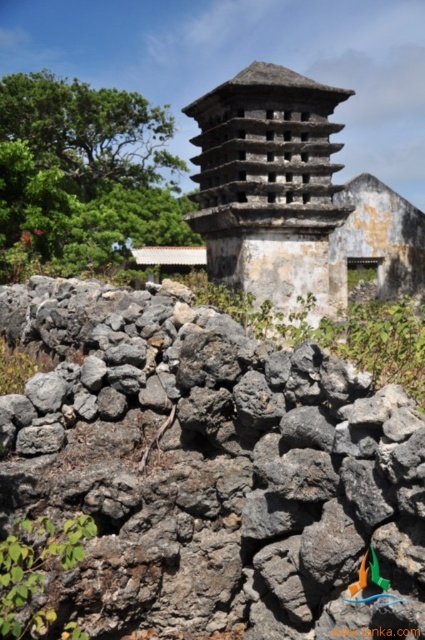
You are an architect assessing the stability of the gray stone tower at center. Given that the volcanic rock wall at center is smaller in size, how does this affect the tower?

The volcanic rock wall at center occupies less space than the gray stone tower at center, so the tower is more stable because it has a larger base area.

You are a geologist examining the historical site. You notice the volcanic rock wall at center and the gray stone tower at center. Based on their positions, which one is located lower in the scene?

The volcanic rock wall at center is positioned under the gray stone tower at center, so it is located lower in the scene.

You are an architect planning to reinforce the structural stability of the gray stone tower at center. The volcanic rock wall at center is nearby. Which structure has a greater thickness that could potentially provide better support?

The gray stone tower at center is thicker than the volcanic rock wall at center, so it has a greater thickness and could potentially provide better support.